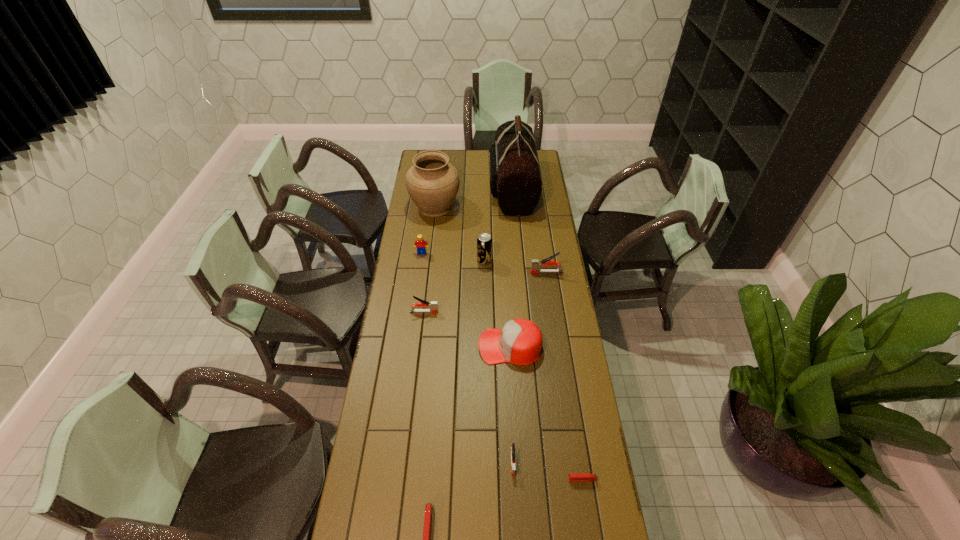
You are a GUI agent. You are given a task and a screenshot of the screen. Output one action in this format:
    pyautogui.click(x=<x>, y=<y>)
    Task: Click on the vacant space that's between the leftmost gray stapler and the biggest gray stapler
    The height and width of the screenshot is (540, 960).
    Given the screenshot: What is the action you would take?
    pyautogui.click(x=486, y=292)

The width and height of the screenshot is (960, 540). Identify the location of free space between the urn and the fifth nearest object. (429, 259).

The image size is (960, 540). Find the location of `vacant space that's between the ninth shortest object and the eighth shortest object`. vacant space that's between the ninth shortest object and the eighth shortest object is located at coordinates (460, 234).

Select which object is the ninth closest to the urn. Please provide its 2D coordinates. Your answer should be formatted as a tuple, i.e. [(x, y)], where the tuple contains the x and y coordinates of a point satisfying the conditions above.

[(428, 508)]

At what (x,y) coordinates should I click in order to perform the action: click on object that is the closest to the second farthest stapler. Please return your answer as a coordinate pair (x, y). The width and height of the screenshot is (960, 540). Looking at the image, I should click on (520, 341).

Select which stapler appears as the fifth closest to the soda can. Please provide its 2D coordinates. Your answer should be formatted as a tuple, i.e. [(x, y)], where the tuple contains the x and y coordinates of a point satisfying the conditions above.

[(428, 508)]

Locate an element on the screen. Image resolution: width=960 pixels, height=540 pixels. stapler that is the fifth closest to the urn is located at coordinates (428, 508).

In order to click on the second closest gray stapler to the fourth nearest stapler in this screenshot , I will do `click(512, 448)`.

Locate which gray stapler ranks second in proximity to the sixth farthest object. Please provide its 2D coordinates. Your answer should be formatted as a tuple, i.e. [(x, y)], where the tuple contains the x and y coordinates of a point satisfying the conditions above.

[(512, 448)]

The height and width of the screenshot is (540, 960). Find the location of `vacant area that satisfies the following two spatial constraints: 1. on the front-facing side of the third farthest object; 2. on the right side of the fourth farthest object`. vacant area that satisfies the following two spatial constraints: 1. on the front-facing side of the third farthest object; 2. on the right side of the fourth farthest object is located at coordinates (420, 261).